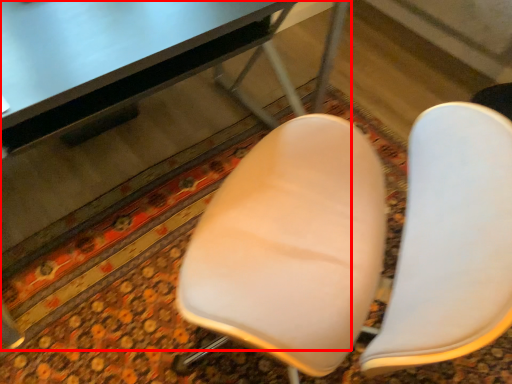
Question: From the image's perspective, considering the relative positions of table (annotated by the red box) and chair in the image provided, where is table (annotated by the red box) located with respect to the staircase?

Choices:
 (A) above
 (B) below

Answer: (A)